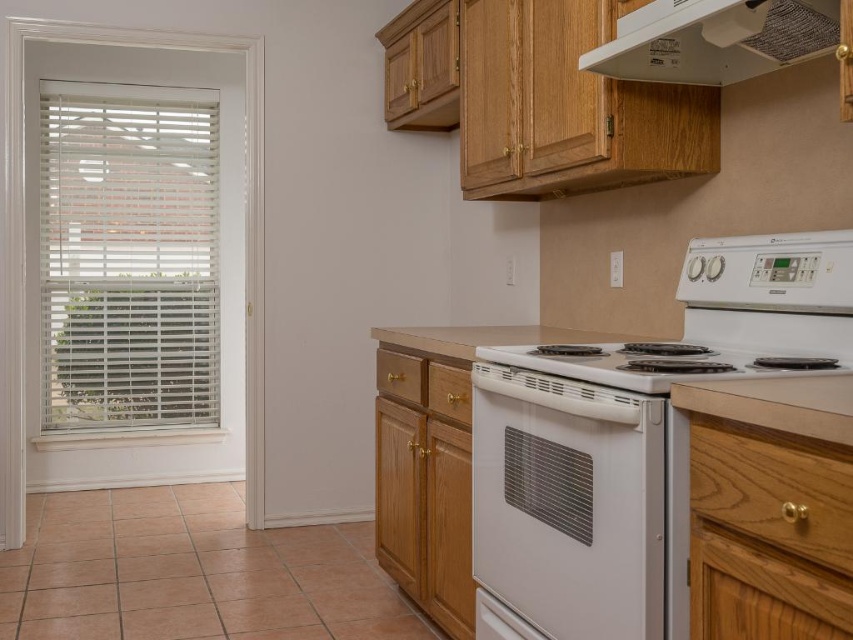
Which is behind, point (639, 432) or point (781, 29)?

Positioned behind is point (781, 29).

Who is higher up, white glossy electric stove at center right or white textured exhaust hood at upper center?

Positioned higher is white textured exhaust hood at upper center.

The image size is (853, 640). Describe the element at coordinates (631, 440) in the screenshot. I see `white glossy electric stove at center right` at that location.

Find the location of `white glossy electric stove at center right`. white glossy electric stove at center right is located at coordinates (631, 440).

Which of these two, white textured exhaust hood at upper center or white glossy stove at center, stands taller?

white textured exhaust hood at upper center is taller.

Which of these two, white textured exhaust hood at upper center or white glossy stove at center, stands shorter?

white glossy stove at center

Between point (732, 60) and point (665, 381), which one is positioned behind?

Point (732, 60)

I want to click on white textured exhaust hood at upper center, so click(x=714, y=38).

Looking at this image, is white glossy electric stove at center right smaller than white glossy oven at center?

No, white glossy electric stove at center right is not smaller than white glossy oven at center.

Between point (610, 461) and point (614, 484), which one is positioned behind?

Positioned behind is point (610, 461).

Who is more distant from viewer, (808, 243) or (549, 394)?

Positioned behind is point (808, 243).

The image size is (853, 640). What are the coordinates of `white glossy electric stove at center right` in the screenshot? It's located at (631, 440).